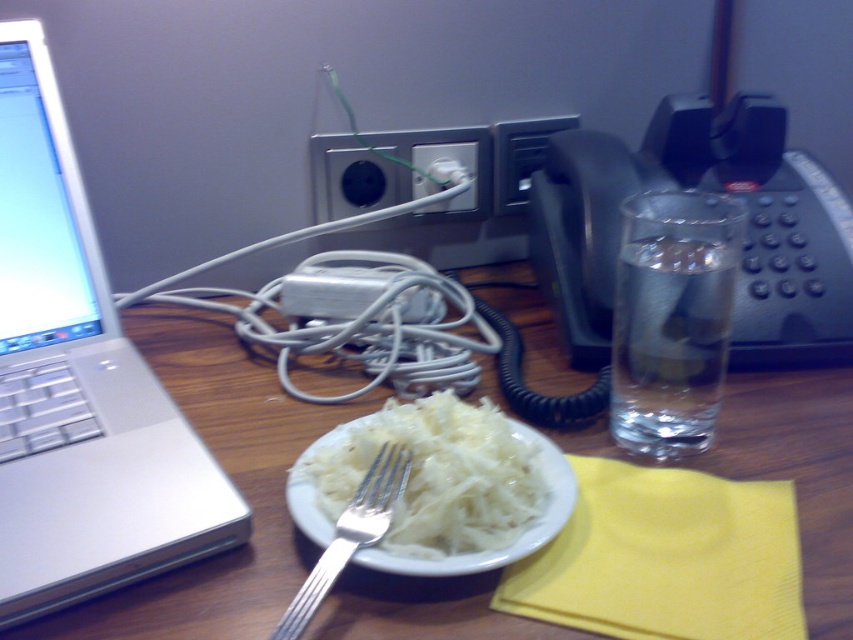
Who is shorter, silver metallic laptop at left or white shredded food at center?

white shredded food at center is shorter.

In the scene shown: Can you confirm if silver metallic laptop at left is bigger than white shredded food at center?

Yes.

The height and width of the screenshot is (640, 853). I want to click on silver metallic laptop at left, so (79, 385).

Between white plate at center and transparent glass water at right, which one is positioned lower?

white plate at center

In the scene shown: Between white plate at center and transparent glass water at right, which one appears on the right side from the viewer's perspective?

Positioned to the right is transparent glass water at right.

This screenshot has height=640, width=853. What do you see at coordinates (231, 480) in the screenshot?
I see `white plate at center` at bounding box center [231, 480].

The height and width of the screenshot is (640, 853). In order to click on white plate at center in this screenshot , I will do click(231, 480).

In the scene shown: Who is more forward, [263,460] or [100,317]?

Point [263,460] is in front.

Locate an element on the screen. The width and height of the screenshot is (853, 640). white plate at center is located at coordinates (231, 480).

Image resolution: width=853 pixels, height=640 pixels. What are the coordinates of `white plate at center` in the screenshot? It's located at (231, 480).